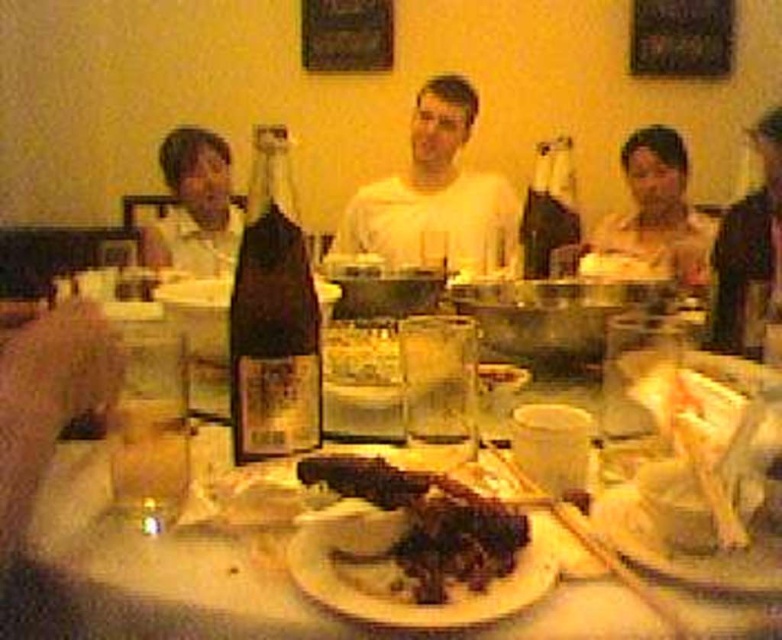
Question: Does brown crispy meat at center lie behind dark glass bottle at center?

Choices:
 (A) no
 (B) yes

Answer: (A)

Question: Which object is positioned farthest from the brown crispy meat at center?

Choices:
 (A) brown glass bottle at center
 (B) white matte shirt at center
 (C) translucent glass at table center

Answer: (B)

Question: In this image, where is matte black shirt at left located relative to translucent glass at table center?

Choices:
 (A) below
 (B) above

Answer: (B)

Question: Which object is positioned farthest from the matte black shirt at left?

Choices:
 (A) dark brown leather jacket at right
 (B) dark brown wooden platter at lower right
 (C) smooth skin face at upper right
 (D) brown crispy meat at center

Answer: (B)

Question: Does brown glass bottle at center appear under dark glass bottle at center?

Choices:
 (A) no
 (B) yes

Answer: (B)

Question: Estimate the real-world distances between objects in this image. Which object is closer to the translucent glass at table center?

Choices:
 (A) dark brown leather jacket at right
 (B) smooth skin face at upper right
 (C) dark brown wooden platter at lower right

Answer: (C)